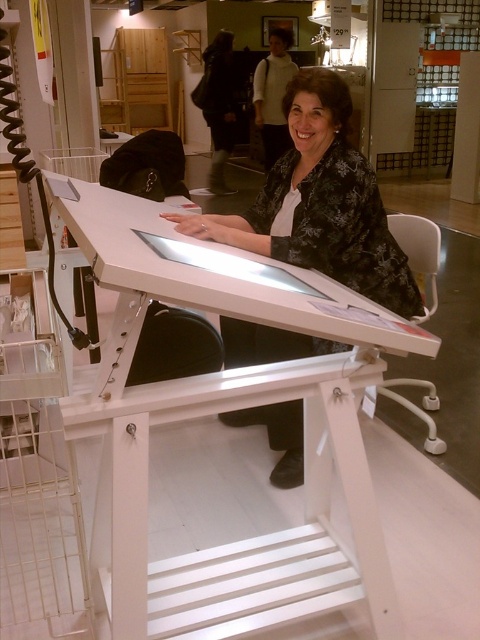
You are a customer in the store and want to touch the black floral blouse at center. However, the white matte table at center is blocking your path. Can you walk around the table to reach the blouse?

The white matte table at center is to the left of the black floral blouse at center, so you can walk around the right side of the table to reach the blouse.

You are a delivery person who needs to place a small package between the white matte table at center and the black floral blouse at center. Can you fit the package in the space between them?

The white matte table at center and the black floral blouse at center are 17.93 inches apart from each other. If the package is smaller than 17.93 inches in width, it can fit between them.

You are a customer in the store and want to take a photo of the desk. The store has two points marked as reference points for photography. Which of the two points, point (207, 627) or point (336, 113), is closer to your camera position?

Point (207, 627) is closer to the camera than point (336, 113), so it is the better reference point for taking a photo of the desk.